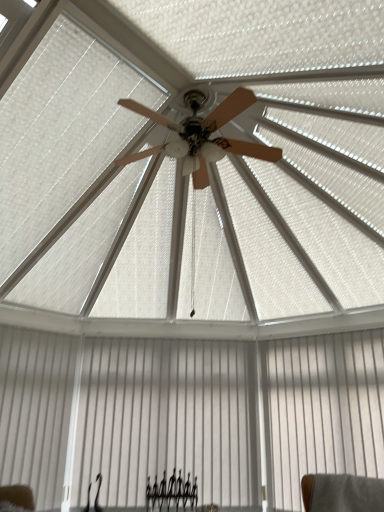
Question: Should I look upward or downward to see white smooth shutter at lower left?

Choices:
 (A) up
 (B) down

Answer: (B)

Question: Is black metal fence at lower center positioned with its back to white matte curtain at lower center, the 2th curtain from the right?

Choices:
 (A) yes
 (B) no

Answer: (A)

Question: Is black metal fence at lower center far from white matte curtain at lower center, which is counted as the 1th curtain, starting from the left?

Choices:
 (A) yes
 (B) no

Answer: (B)

Question: Does black metal fence at lower center have a larger size compared to white matte curtain at lower center, which is counted as the 1th curtain, starting from the left?

Choices:
 (A) no
 (B) yes

Answer: (A)

Question: From the image's perspective, is black metal fence at lower center beneath white matte curtain at lower center, the 2th curtain from the right?

Choices:
 (A) no
 (B) yes

Answer: (B)

Question: From the image's perspective, is black metal fence at lower center on white matte curtain at lower center, which is counted as the 1th curtain, starting from the left?

Choices:
 (A) no
 (B) yes

Answer: (A)

Question: Is black metal fence at lower center at the right side of white matte curtain at lower center, which is counted as the 1th curtain, starting from the left?

Choices:
 (A) no
 (B) yes

Answer: (B)

Question: Does white smooth shutter at lower left have a greater width compared to black metal fence at lower center?

Choices:
 (A) yes
 (B) no

Answer: (B)

Question: From a real-world perspective, is white smooth shutter at lower left under black metal fence at lower center?

Choices:
 (A) yes
 (B) no

Answer: (B)

Question: Is white smooth shutter at lower left aimed at black metal fence at lower center?

Choices:
 (A) no
 (B) yes

Answer: (A)

Question: Is white smooth shutter at lower left positioned in front of black metal fence at lower center?

Choices:
 (A) no
 (B) yes

Answer: (B)

Question: Does white smooth shutter at lower left have a smaller size compared to black metal fence at lower center?

Choices:
 (A) yes
 (B) no

Answer: (B)

Question: From a real-world perspective, is white smooth shutter at lower left located higher than black metal fence at lower center?

Choices:
 (A) yes
 (B) no

Answer: (A)

Question: From a real-world perspective, is white smooth shutter at lower left over white matte curtain at lower center, the 2th curtain from the right?

Choices:
 (A) no
 (B) yes

Answer: (A)